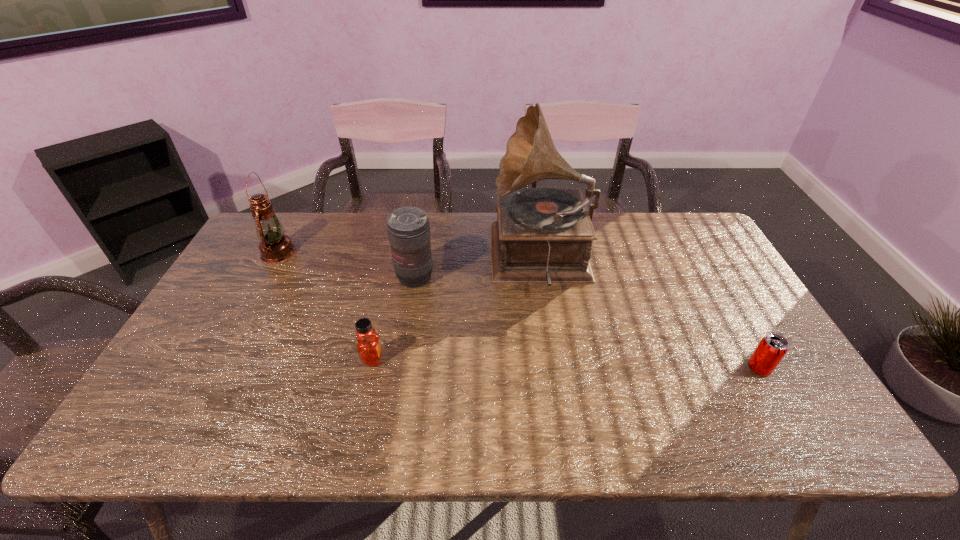
In the image, there is a desktop. Where is `vacant area at the far edge`? vacant area at the far edge is located at coordinates (449, 217).

Locate an element on the screen. vacant area at the near edge of the desktop is located at coordinates (455, 441).

The width and height of the screenshot is (960, 540). I want to click on blank space at the left edge, so coord(212,311).

The height and width of the screenshot is (540, 960). I want to click on free location at the right edge, so click(802, 401).

Image resolution: width=960 pixels, height=540 pixels. I want to click on vacant space at the far right corner of the desktop, so click(696, 254).

I want to click on vacant area at the near right corner, so click(768, 417).

This screenshot has width=960, height=540. Identify the location of unoccupied position between the telephoto lens and the second object from right to left. (478, 268).

Locate an element on the screen. The height and width of the screenshot is (540, 960). free space between the third tallest object and the tallest object is located at coordinates (478, 268).

Find the location of a particular element. This screenshot has width=960, height=540. empty space that is in between the second tallest object and the soda can is located at coordinates (518, 310).

This screenshot has height=540, width=960. Find the location of `free space between the oil lamp and the fourth tallest object`. free space between the oil lamp and the fourth tallest object is located at coordinates (325, 306).